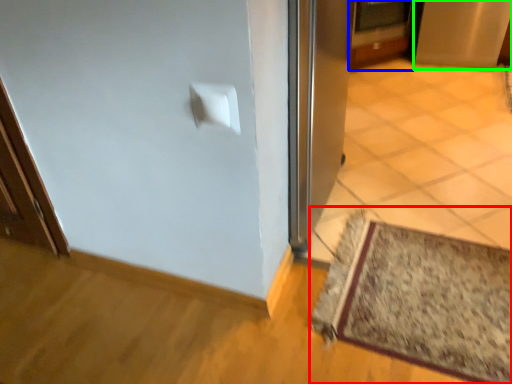
Question: Estimate the real-world distances between objects in this image. Which object is farther from mat (highlighted by a red box), door (highlighted by a blue box) or screen door (highlighted by a green box)?

Choices:
 (A) door
 (B) screen door

Answer: (B)